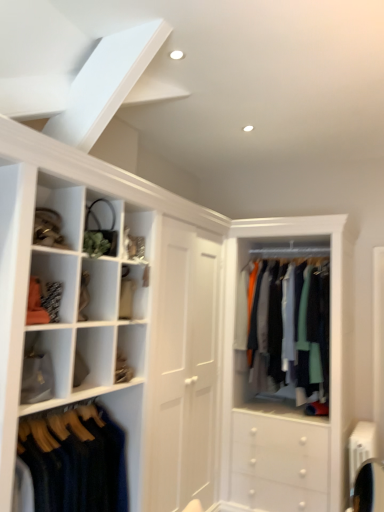
Find the location of a particular element. This screenshot has height=512, width=384. dark blue wool sweater at lower left, placed as the first clothing when sorted from left to right is located at coordinates (76, 461).

Describe the element at coordinates (45, 365) in the screenshot. This screenshot has height=512, width=384. I see `matte white shelf at lower left, placed as the first cabinet when sorted from bottom to top` at that location.

What do you see at coordinates (101, 225) in the screenshot? I see `matte black purse at upper left, which is the third cabinet in bottom-to-top order` at bounding box center [101, 225].

At what (x,y) coordinates should I click in order to perform the action: click on matte gold purse at upper left, marked as the 2th cabinet in a bottom-to-top arrangement. Please return your answer as a coordinate pair (x, y). The width and height of the screenshot is (384, 512). Looking at the image, I should click on (65, 210).

Describe the element at coordinates (65, 210) in the screenshot. I see `matte gold purse at upper left, the second cabinet positioned from the top` at that location.

Locate an element on the screen. The height and width of the screenshot is (512, 384). dark blue wool sweater at lower left, placed as the first clothing when sorted from left to right is located at coordinates (76, 461).

From a real-world perspective, does dark blue wool sweater at lower left, which appears as the second clothing when viewed from the right, sit lower than silky cotton shirts at center, which is counted as the first clothing, starting from the right?

Yes, from a real-world perspective, dark blue wool sweater at lower left, which appears as the second clothing when viewed from the right, is beneath silky cotton shirts at center, which is counted as the first clothing, starting from the right.

In the scene shown: Which of these two, dark blue wool sweater at lower left, acting as the 1th clothing starting from the front, or silky cotton shirts at center, the 1th clothing from the back, stands taller?

silky cotton shirts at center, the 1th clothing from the back.

Is dark blue wool sweater at lower left, placed as the first clothing when sorted from left to right, with silky cotton shirts at center, the 1th clothing from the back?

There is a gap between dark blue wool sweater at lower left, placed as the first clothing when sorted from left to right, and silky cotton shirts at center, the 1th clothing from the back.

Locate an element on the screen. This screenshot has width=384, height=512. clothing behind the dark blue wool sweater at lower left, which is the 2th clothing in back-to-front order is located at coordinates [285, 325].

From their relative heights in the image, would you say matte white shelf at lower left, placed as the first cabinet when sorted from bottom to top, is taller or shorter than matte black purse at upper left, arranged as the first cabinet when viewed from the top?

Considering their sizes, matte white shelf at lower left, placed as the first cabinet when sorted from bottom to top, has less height than matte black purse at upper left, arranged as the first cabinet when viewed from the top.

From the matte black purse at upper left, arranged as the first cabinet when viewed from the top, count 2nd cabinets forward and point to it. Please provide its 2D coordinates.

[(45, 365)]

Considering the positions of points (33, 390) and (88, 224), is point (33, 390) farther from camera compared to point (88, 224)?

No, (33, 390) is closer to viewer.

From the picture: Is matte white shelf at lower left, placed as the first cabinet when sorted from bottom to top, touching matte black purse at upper left, arranged as the first cabinet when viewed from the top?

No, matte white shelf at lower left, placed as the first cabinet when sorted from bottom to top, is not with matte black purse at upper left, arranged as the first cabinet when viewed from the top.

Is matte black purse at upper left, which is the third cabinet in bottom-to-top order, looking in the opposite direction of silky cotton shirts at center, placed as the 2th clothing when sorted from front to back?

No, silky cotton shirts at center, placed as the 2th clothing when sorted from front to back, is not at the back of matte black purse at upper left, which is the third cabinet in bottom-to-top order.

Who is shorter, matte black purse at upper left, arranged as the first cabinet when viewed from the top, or silky cotton shirts at center, placed as the 2th clothing when sorted from front to back?

matte black purse at upper left, arranged as the first cabinet when viewed from the top.

From a real-world perspective, which is physically above, matte black purse at upper left, which is the third cabinet in bottom-to-top order, or silky cotton shirts at center, the 1th clothing from the back?

matte black purse at upper left, which is the third cabinet in bottom-to-top order.

From the image's perspective, which is above, matte black purse at upper left, which is the third cabinet in bottom-to-top order, or silky cotton shirts at center, the 1th clothing from the back?

matte black purse at upper left, which is the third cabinet in bottom-to-top order, from the image's perspective.

Is matte black purse at upper left, arranged as the first cabinet when viewed from the top, bigger or smaller than dark blue wool sweater at lower left, acting as the 1th clothing starting from the front?

In the image, matte black purse at upper left, arranged as the first cabinet when viewed from the top, appears to be smaller than dark blue wool sweater at lower left, acting as the 1th clothing starting from the front.

Is the position of matte black purse at upper left, which is the third cabinet in bottom-to-top order, more distant than that of dark blue wool sweater at lower left, which is the 2th clothing in back-to-front order?

Yes, matte black purse at upper left, which is the third cabinet in bottom-to-top order, is behind dark blue wool sweater at lower left, which is the 2th clothing in back-to-front order.

Is matte black purse at upper left, which is the third cabinet in bottom-to-top order, taller or shorter than dark blue wool sweater at lower left, placed as the first clothing when sorted from left to right?

Clearly, matte black purse at upper left, which is the third cabinet in bottom-to-top order, is shorter compared to dark blue wool sweater at lower left, placed as the first clothing when sorted from left to right.

Considering the relative sizes of matte black purse at upper left, arranged as the first cabinet when viewed from the top, and matte gold purse at upper left, the second cabinet positioned from the top, in the image provided, is matte black purse at upper left, arranged as the first cabinet when viewed from the top, smaller than matte gold purse at upper left, the second cabinet positioned from the top,?

Yes.

Would you say matte black purse at upper left, which is the third cabinet in bottom-to-top order, contains matte gold purse at upper left, marked as the 2th cabinet in a bottom-to-top arrangement?

No, matte gold purse at upper left, marked as the 2th cabinet in a bottom-to-top arrangement, is located outside of matte black purse at upper left, which is the third cabinet in bottom-to-top order.

Is matte black purse at upper left, arranged as the first cabinet when viewed from the top, beside matte gold purse at upper left, marked as the 2th cabinet in a bottom-to-top arrangement?

No, matte black purse at upper left, arranged as the first cabinet when viewed from the top, is not next to matte gold purse at upper left, marked as the 2th cabinet in a bottom-to-top arrangement.

Is point (112, 236) positioned after point (64, 218)?

Yes.

From the image's perspective, which cabinet is the 2nd one below the matte black purse at upper left, which is the third cabinet in bottom-to-top order? Please provide its 2D coordinates.

[(45, 365)]

Is matte black purse at upper left, arranged as the first cabinet when viewed from the top, oriented towards matte white shelf at lower left, positioned as the third cabinet in top-to-bottom order?

No, matte black purse at upper left, arranged as the first cabinet when viewed from the top, is not aimed at matte white shelf at lower left, positioned as the third cabinet in top-to-bottom order.

Is matte black purse at upper left, arranged as the first cabinet when viewed from the top, bigger than matte white shelf at lower left, positioned as the third cabinet in top-to-bottom order?

Actually, matte black purse at upper left, arranged as the first cabinet when viewed from the top, might be smaller than matte white shelf at lower left, positioned as the third cabinet in top-to-bottom order.

Measure the distance from matte black purse at upper left, which is the third cabinet in bottom-to-top order, to matte white shelf at lower left, positioned as the third cabinet in top-to-bottom order.

matte black purse at upper left, which is the third cabinet in bottom-to-top order, and matte white shelf at lower left, positioned as the third cabinet in top-to-bottom order, are 24.61 inches apart from each other.

Considering the positions of objects dark blue wool sweater at lower left, acting as the 1th clothing starting from the front, and matte white shelf at lower left, placed as the first cabinet when sorted from bottom to top, in the image provided, who is more to the left, dark blue wool sweater at lower left, acting as the 1th clothing starting from the front, or matte white shelf at lower left, placed as the first cabinet when sorted from bottom to top,?

Positioned to the left is matte white shelf at lower left, placed as the first cabinet when sorted from bottom to top.

Is dark blue wool sweater at lower left, placed as the first clothing when sorted from left to right, taller than matte white shelf at lower left, placed as the first cabinet when sorted from bottom to top?

Indeed, dark blue wool sweater at lower left, placed as the first clothing when sorted from left to right, has a greater height compared to matte white shelf at lower left, placed as the first cabinet when sorted from bottom to top.

Does dark blue wool sweater at lower left, placed as the first clothing when sorted from left to right, come in front of matte white shelf at lower left, positioned as the third cabinet in top-to-bottom order?

That is True.

Is point (96, 469) behind point (52, 358)?

Yes.

Identify the location of clothing in front of the silky cotton shirts at center, the 1th clothing from the back. (76, 461).

The height and width of the screenshot is (512, 384). I want to click on the 2nd cabinet counting from the right of the matte white shelf at lower left, positioned as the third cabinet in top-to-bottom order, so click(x=101, y=225).

When comparing their distances from matte black purse at upper left, which is the third cabinet in bottom-to-top order, does dark blue wool sweater at lower left, acting as the 1th clothing starting from the front, or silky cotton shirts at center, placed as the 2th clothing when sorted from front to back, seem further?

silky cotton shirts at center, placed as the 2th clothing when sorted from front to back, lies further to matte black purse at upper left, which is the third cabinet in bottom-to-top order, than the other object.

Looking at the image, which one is located closer to silky cotton shirts at center, placed as the 2th clothing when sorted from front to back, matte white shelf at lower left, placed as the first cabinet when sorted from bottom to top, or matte black purse at upper left, which is the third cabinet in bottom-to-top order?

matte black purse at upper left, which is the third cabinet in bottom-to-top order.

Considering their positions, is matte gold purse at upper left, the second cabinet positioned from the top, positioned closer to matte black purse at upper left, which is the third cabinet in bottom-to-top order, than dark blue wool sweater at lower left, placed as the first clothing when sorted from left to right?

matte gold purse at upper left, the second cabinet positioned from the top, is closer to matte black purse at upper left, which is the third cabinet in bottom-to-top order.

Looking at the image, which one is located closer to matte black purse at upper left, which is the third cabinet in bottom-to-top order, matte white shelf at lower left, placed as the first cabinet when sorted from bottom to top, or silky cotton shirts at center, the 1th clothing from the back?

matte white shelf at lower left, placed as the first cabinet when sorted from bottom to top.

Estimate the real-world distances between objects in this image. Which object is further from silky cotton shirts at center, placed as the 2th clothing when sorted from front to back, matte black purse at upper left, arranged as the first cabinet when viewed from the top, or dark blue wool sweater at lower left, placed as the first clothing when sorted from left to right?

matte black purse at upper left, arranged as the first cabinet when viewed from the top, is positioned further to the anchor silky cotton shirts at center, placed as the 2th clothing when sorted from front to back.

Considering their positions, is dark blue wool sweater at lower left, acting as the 1th clothing starting from the front, positioned further to silky cotton shirts at center, placed as the 2th clothing when sorted from front to back, than matte gold purse at upper left, the second cabinet positioned from the top?

matte gold purse at upper left, the second cabinet positioned from the top.

Considering their positions, is silky cotton shirts at center, the 1th clothing from the back, positioned further to matte gold purse at upper left, the second cabinet positioned from the top, than dark blue wool sweater at lower left, which is the 2th clothing in back-to-front order?

Among the two, silky cotton shirts at center, the 1th clothing from the back, is located further to matte gold purse at upper left, the second cabinet positioned from the top.

Looking at the image, which one is located further to silky cotton shirts at center, which is counted as the first clothing, starting from the right, matte gold purse at upper left, the second cabinet positioned from the top, or matte black purse at upper left, which is the third cabinet in bottom-to-top order?

matte gold purse at upper left, the second cabinet positioned from the top, lies further to silky cotton shirts at center, which is counted as the first clothing, starting from the right, than the other object.

What are the coordinates of `clothing located between matte white shelf at lower left, positioned as the third cabinet in top-to-bottom order, and silky cotton shirts at center, placed as the 2th clothing when sorted from front to back, in the left-right direction` in the screenshot? It's located at (76, 461).

The image size is (384, 512). In order to click on cabinet between dark blue wool sweater at lower left, which is the 2th clothing in back-to-front order, and silky cotton shirts at center, which is counted as the first clothing, starting from the right in this screenshot , I will do `click(101, 225)`.

Identify the location of cabinet between matte black purse at upper left, arranged as the first cabinet when viewed from the top, and matte white shelf at lower left, positioned as the third cabinet in top-to-bottom order, in the up-down direction. This screenshot has width=384, height=512. (65, 210).

Identify the location of cabinet between matte gold purse at upper left, marked as the 2th cabinet in a bottom-to-top arrangement, and silky cotton shirts at center, the 1th clothing from the back. The height and width of the screenshot is (512, 384). click(x=101, y=225).